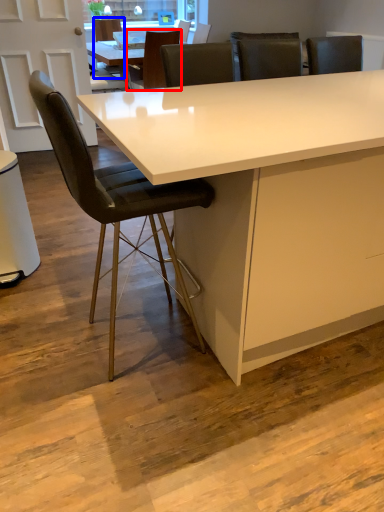
Question: Which object is closer to the camera taking this photo, chair (highlighted by a red box) or chair (highlighted by a blue box)?

Choices:
 (A) chair
 (B) chair

Answer: (A)